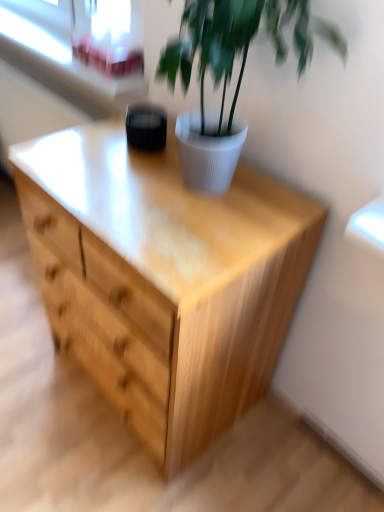
Question: From the image's perspective, is white ribbed pot at upper center positioned above or below white plastic window frame at upper left?

Choices:
 (A) below
 (B) above

Answer: (A)

Question: In the image, is white ribbed pot at upper center positioned in front of or behind white plastic window frame at upper left?

Choices:
 (A) behind
 (B) front

Answer: (B)

Question: Which is nearer to the white plastic window frame at upper left?

Choices:
 (A) white ribbed pot at upper center
 (B) natural wood chest of drawers at center
 (C) transparent glass window screen at upper left

Answer: (C)

Question: Which of these objects is positioned farthest from the transparent glass window screen at upper left?

Choices:
 (A) natural wood chest of drawers at center
 (B) white ribbed pot at upper center
 (C) white plastic window frame at upper left

Answer: (A)